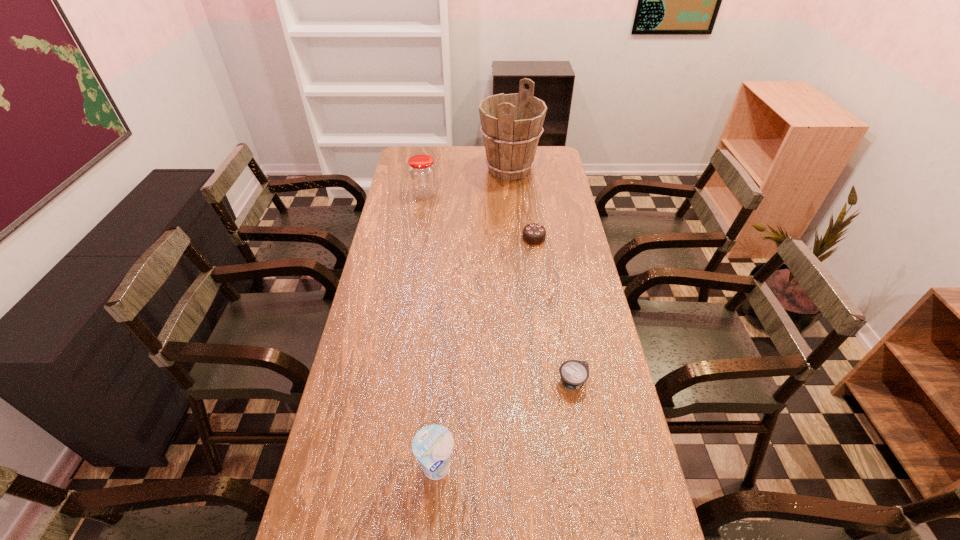
You are a GUI agent. You are given a task and a screenshot of the screen. Output one action in this format:
    pyautogui.click(x=<x>, y=<y>)
    Task: Click on the tallest object
    
    Given the screenshot: What is the action you would take?
    (511, 124)

Identify the location of jar. This screenshot has width=960, height=540. (422, 174).

What are the coordinates of `the second tallest object` in the screenshot? It's located at (422, 174).

This screenshot has width=960, height=540. Find the location of `the third tallest object`. the third tallest object is located at coordinates (432, 445).

This screenshot has height=540, width=960. Identify the location of the fourth object from right to left. (432, 445).

This screenshot has width=960, height=540. Identify the location of the second shortest object. (534, 234).

I want to click on chocolate cake, so click(534, 234).

Identify the location of the second nearest object. (574, 373).

Where is `the shorter yogurt`? the shorter yogurt is located at coordinates (574, 373).

Find the location of `vacant area situated 0.100m on the left of the tallest object`. vacant area situated 0.100m on the left of the tallest object is located at coordinates pyautogui.click(x=457, y=170).